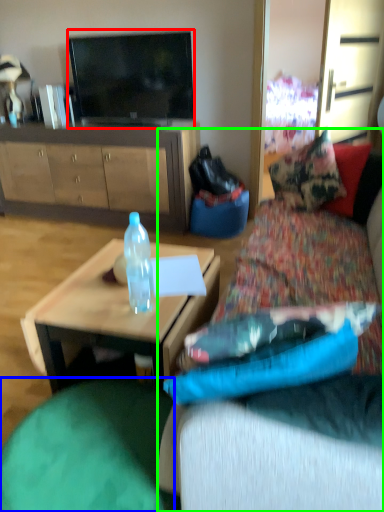
Question: Which object is the closest to the television (highlighted by a red box)? Choose among these: bean bag chair (highlighted by a blue box) or studio couch (highlighted by a green box).

Choices:
 (A) bean bag chair
 (B) studio couch

Answer: (A)